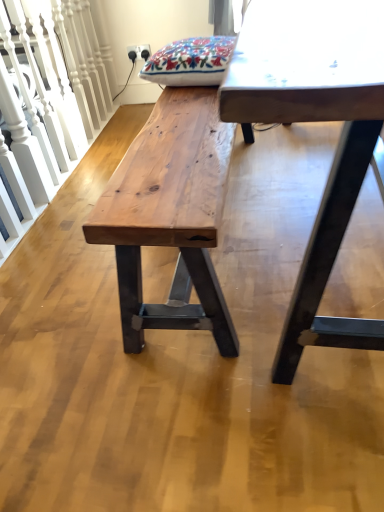
Question: Is natural wood bench at left far from natural wood bench at center?

Choices:
 (A) yes
 (B) no

Answer: (B)

Question: Is natural wood bench at left next to natural wood bench at center and touching it?

Choices:
 (A) yes
 (B) no

Answer: (B)

Question: Is the position of natural wood bench at left more distant than that of natural wood bench at center?

Choices:
 (A) yes
 (B) no

Answer: (A)

Question: Is natural wood bench at left smaller than natural wood bench at center?

Choices:
 (A) no
 (B) yes

Answer: (B)

Question: Can you confirm if natural wood bench at left is wider than natural wood bench at center?

Choices:
 (A) yes
 (B) no

Answer: (B)

Question: In terms of size, does natural wood bench at center appear bigger or smaller than natural wood bench at left?

Choices:
 (A) small
 (B) big

Answer: (B)

Question: In the image, is natural wood bench at center on the left side or the right side of natural wood bench at left?

Choices:
 (A) right
 (B) left

Answer: (A)

Question: Considering the positions of natural wood bench at center and natural wood bench at left in the image, is natural wood bench at center taller or shorter than natural wood bench at left?

Choices:
 (A) short
 (B) tall

Answer: (A)

Question: In terms of width, does natural wood bench at center look wider or thinner when compared to natural wood bench at left?

Choices:
 (A) thin
 (B) wide

Answer: (B)

Question: Relative to natural wood bench at left, is smooth white table at center in front or behind?

Choices:
 (A) front
 (B) behind

Answer: (A)

Question: From a real-world perspective, relative to natural wood bench at left, is smooth white table at center vertically above or below?

Choices:
 (A) above
 (B) below

Answer: (A)

Question: Looking at their shapes, would you say smooth white table at center is wider or thinner than natural wood bench at left?

Choices:
 (A) wide
 (B) thin

Answer: (A)

Question: Choose the correct answer: Is smooth white table at center inside natural wood bench at left or outside it?

Choices:
 (A) outside
 (B) inside

Answer: (A)

Question: Relative to natural wood bench at center, is natural wood bench at left in front or behind?

Choices:
 (A) front
 (B) behind

Answer: (B)

Question: In the image, is natural wood bench at left on the left side or the right side of natural wood bench at center?

Choices:
 (A) left
 (B) right

Answer: (A)